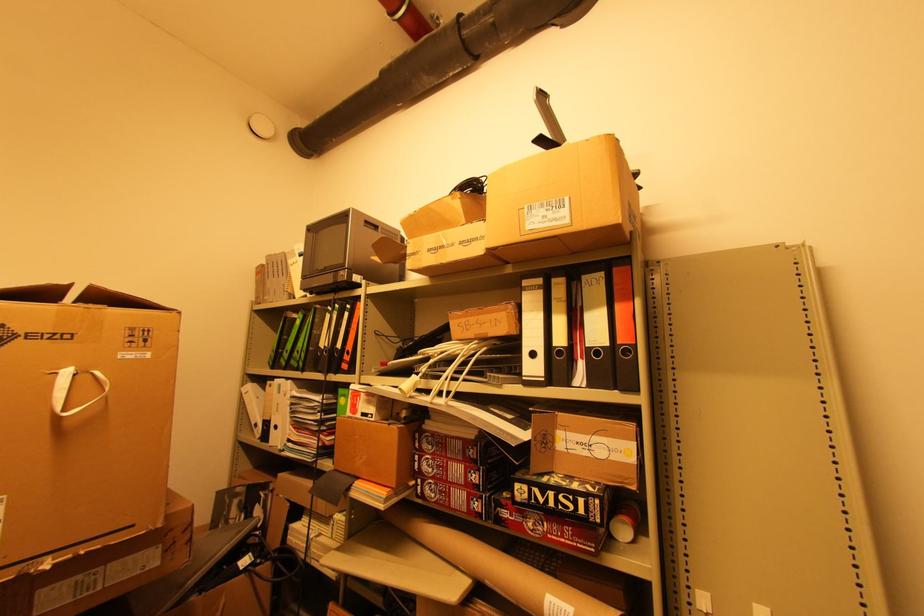
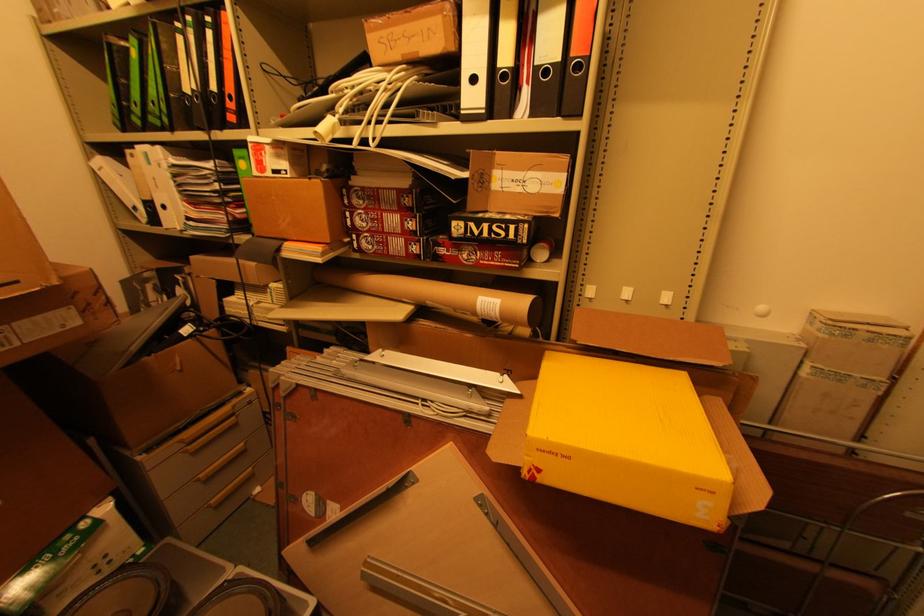
Question: The images are taken continuously from a first-person perspective. In which direction is your viewpoint rotating?

Choices:
 (A) Left
 (B) Right
 (C) Up
 (D) Down

Answer: (D)